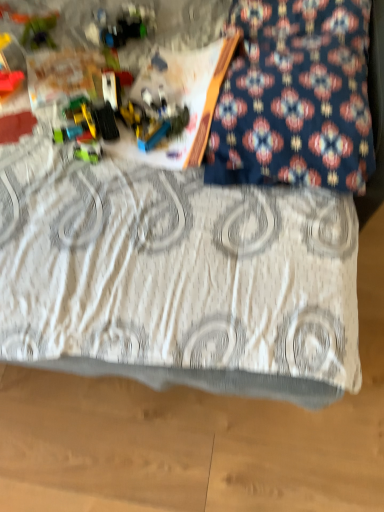
Question: Is translucent plastic construction set at upper left, the 1th toy in the bottom-to-top sequence, oriented away from shiny plastic toy at upper left, which is the 1th toy in top-to-bottom order?

Choices:
 (A) yes
 (B) no

Answer: (A)

Question: From a real-world perspective, is translucent plastic construction set at upper left, the 1th toy in the bottom-to-top sequence, on top of shiny plastic toy at upper left, the 3th toy when ordered from bottom to top?

Choices:
 (A) yes
 (B) no

Answer: (B)

Question: Is translucent plastic construction set at upper left, the 1th toy in the bottom-to-top sequence, positioned far away from shiny plastic toy at upper left, the 3th toy when ordered from bottom to top?

Choices:
 (A) yes
 (B) no

Answer: (B)

Question: Are translucent plastic construction set at upper left, positioned as the 3th toy in top-to-bottom order, and shiny plastic toy at upper left, which is the 1th toy in top-to-bottom order, making contact?

Choices:
 (A) no
 (B) yes

Answer: (A)

Question: Considering the relative sizes of translucent plastic construction set at upper left, the 1th toy in the bottom-to-top sequence, and shiny plastic toy at upper left, which is the 1th toy in top-to-bottom order, in the image provided, is translucent plastic construction set at upper left, the 1th toy in the bottom-to-top sequence, wider than shiny plastic toy at upper left, which is the 1th toy in top-to-bottom order,?

Choices:
 (A) no
 (B) yes

Answer: (A)

Question: Considering the relative sizes of translucent plastic construction set at upper left, the 1th toy in the bottom-to-top sequence, and shiny plastic toy at upper left, the 3th toy when ordered from bottom to top, in the image provided, is translucent plastic construction set at upper left, the 1th toy in the bottom-to-top sequence, thinner than shiny plastic toy at upper left, the 3th toy when ordered from bottom to top,?

Choices:
 (A) yes
 (B) no

Answer: (A)

Question: Is translucent plastic construction set at upper left, the 1th toy in the bottom-to-top sequence, located within green plastic toy at upper left, which is the 2th toy from top to bottom?

Choices:
 (A) no
 (B) yes

Answer: (A)

Question: Is green plastic toy at upper left, arranged as the 2th toy when ordered from the bottom, with translucent plastic construction set at upper left, positioned as the 3th toy in top-to-bottom order?

Choices:
 (A) no
 (B) yes

Answer: (A)

Question: Is green plastic toy at upper left, which is the 2th toy from top to bottom, not within translucent plastic construction set at upper left, the 1th toy in the bottom-to-top sequence?

Choices:
 (A) yes
 (B) no

Answer: (A)

Question: Is green plastic toy at upper left, arranged as the 2th toy when ordered from the bottom, aimed at translucent plastic construction set at upper left, the 1th toy in the bottom-to-top sequence?

Choices:
 (A) yes
 (B) no

Answer: (A)

Question: From the image's perspective, is green plastic toy at upper left, arranged as the 2th toy when ordered from the bottom, located above translucent plastic construction set at upper left, the 1th toy in the bottom-to-top sequence?

Choices:
 (A) yes
 (B) no

Answer: (A)

Question: Would you consider green plastic toy at upper left, which is the 2th toy from top to bottom, to be distant from translucent plastic construction set at upper left, positioned as the 3th toy in top-to-bottom order?

Choices:
 (A) yes
 (B) no

Answer: (B)

Question: From a real-world perspective, is green plastic toy at upper left, which is the 2th toy from top to bottom, positioned under shiny plastic toy at upper left, the 3th toy when ordered from bottom to top, based on gravity?

Choices:
 (A) no
 (B) yes

Answer: (B)